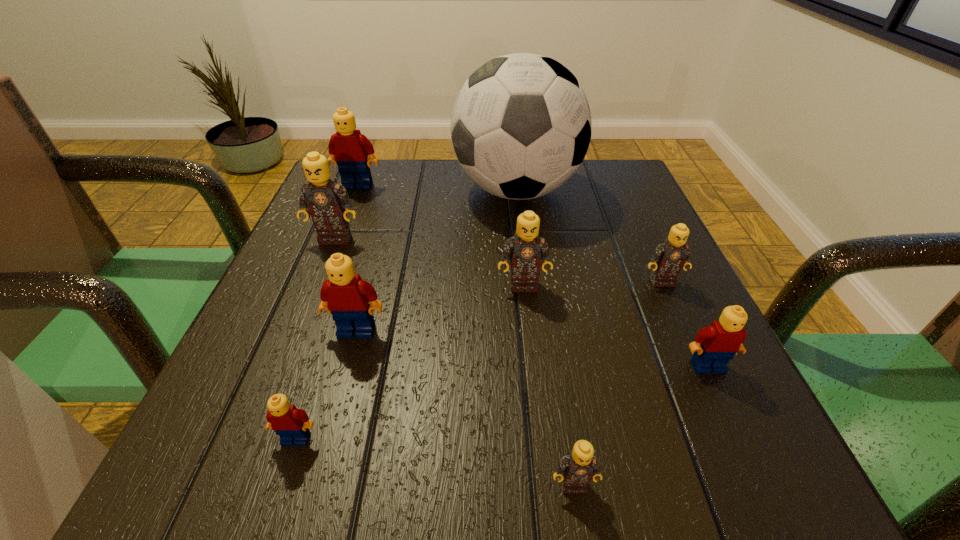
This screenshot has width=960, height=540. I want to click on object positioned at the near left corner, so click(x=292, y=425).

Image resolution: width=960 pixels, height=540 pixels. I want to click on object that is positioned at the far right corner, so click(x=521, y=126).

Locate an element on the screen. The image size is (960, 540). free region at the far edge is located at coordinates (534, 198).

What are the coordinates of `vacant space at the near edge of the desktop` in the screenshot? It's located at (633, 475).

In the image, there is a desktop. At what (x,y) coordinates should I click in order to perform the action: click on free region at the left edge. Please return your answer as a coordinate pair (x, y). Looking at the image, I should click on (307, 330).

What are the coordinates of `free space at the right edge of the desktop` in the screenshot? It's located at (646, 228).

Identify the location of free spot between the second biggest tan Lego and the rightmost tan Lego. (592, 284).

This screenshot has width=960, height=540. What are the coordinates of `unoccupied position between the leftmost tan Lego and the black soccer ball` in the screenshot? It's located at (425, 214).

Where is `vacant space in between the second biggest tan Lego and the nearest yellow Lego`? Image resolution: width=960 pixels, height=540 pixels. vacant space in between the second biggest tan Lego and the nearest yellow Lego is located at coordinates (410, 362).

The image size is (960, 540). I want to click on blank region between the third smallest tan Lego and the farthest yellow Lego, so click(441, 235).